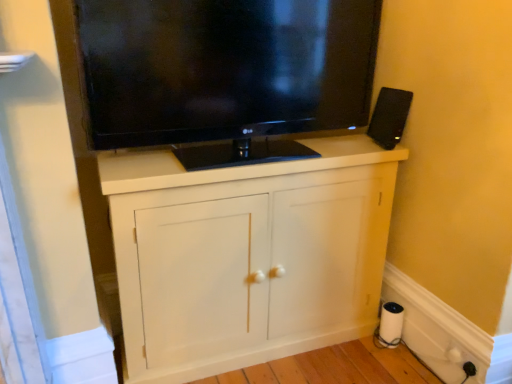
Question: From a real-world perspective, is white matte cabinet at center physically above black plastic speaker at upper right?

Choices:
 (A) yes
 (B) no

Answer: (B)

Question: Is white matte cabinet at center surrounding black plastic speaker at upper right?

Choices:
 (A) no
 (B) yes

Answer: (A)

Question: Is white matte cabinet at center in contact with black plastic speaker at upper right?

Choices:
 (A) yes
 (B) no

Answer: (B)

Question: Does white matte cabinet at center have a lesser height compared to black plastic speaker at upper right?

Choices:
 (A) no
 (B) yes

Answer: (A)

Question: Is white matte cabinet at center looking in the opposite direction of black plastic speaker at upper right?

Choices:
 (A) yes
 (B) no

Answer: (B)

Question: Considering the positions of point (448, 355) and point (303, 54), is point (448, 355) closer or farther from the camera than point (303, 54)?

Choices:
 (A) closer
 (B) farther

Answer: (B)

Question: Is white plastic outlet at lower right, acting as the 2th electric outlet starting from the right, taller or shorter than black glossy tv at upper center?

Choices:
 (A) tall
 (B) short

Answer: (B)

Question: Do you think white plastic outlet at lower right, which is the 1th electric outlet from left to right, is within black glossy tv at upper center, or outside of it?

Choices:
 (A) outside
 (B) inside

Answer: (A)

Question: From a real-world perspective, relative to black glossy tv at upper center, is white plastic outlet at lower right, acting as the 2th electric outlet starting from the right, vertically above or below?

Choices:
 (A) below
 (B) above

Answer: (A)

Question: Is white matte paper towel at lower right spatially inside white matte cabinet at center, or outside of it?

Choices:
 (A) outside
 (B) inside

Answer: (A)

Question: Is point (393, 326) closer or farther from the camera than point (173, 221)?

Choices:
 (A) farther
 (B) closer

Answer: (A)

Question: Looking at their shapes, would you say white matte paper towel at lower right is wider or thinner than white matte cabinet at center?

Choices:
 (A) thin
 (B) wide

Answer: (A)

Question: In terms of size, does white matte paper towel at lower right appear bigger or smaller than white matte cabinet at center?

Choices:
 (A) big
 (B) small

Answer: (B)

Question: Is white matte cabinet at center inside or outside of white plastic outlet at lower right, acting as the 2th electric outlet starting from the right?

Choices:
 (A) outside
 (B) inside

Answer: (A)

Question: From the image's perspective, is white matte cabinet at center located above or below white plastic outlet at lower right, which is the 1th electric outlet from left to right?

Choices:
 (A) above
 (B) below

Answer: (A)